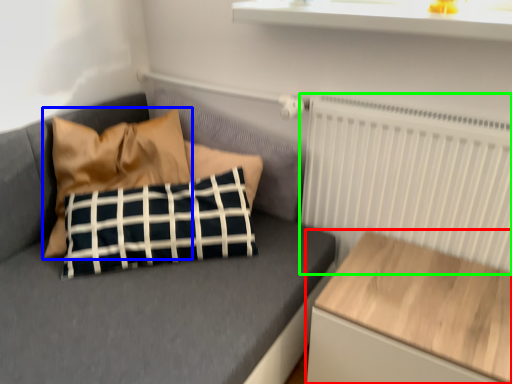
Question: Which is farther away from table (highlighted by a red box)? pillow (highlighted by a blue box) or radiator (highlighted by a green box)?

Choices:
 (A) pillow
 (B) radiator

Answer: (A)